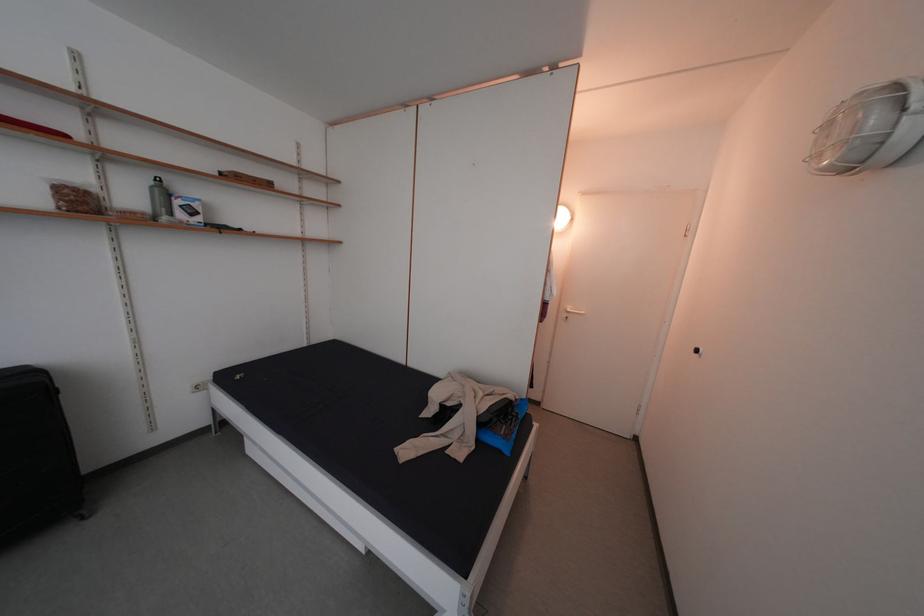
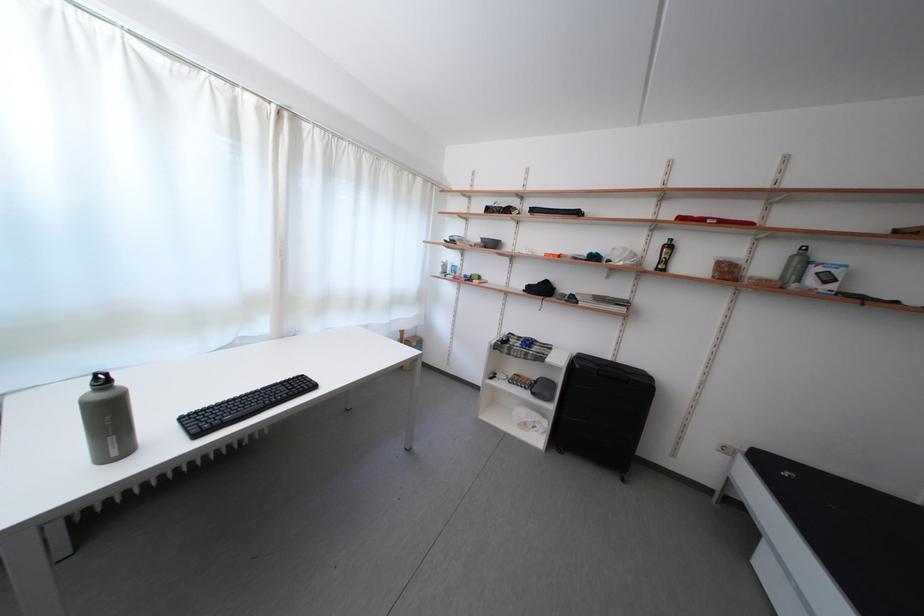
Question: The first image is from the beginning of the video and the second image is from the end. How did the camera likely rotate when shooting the video?

Choices:
 (A) Left
 (B) Right
 (C) Up
 (D) Down

Answer: (A)